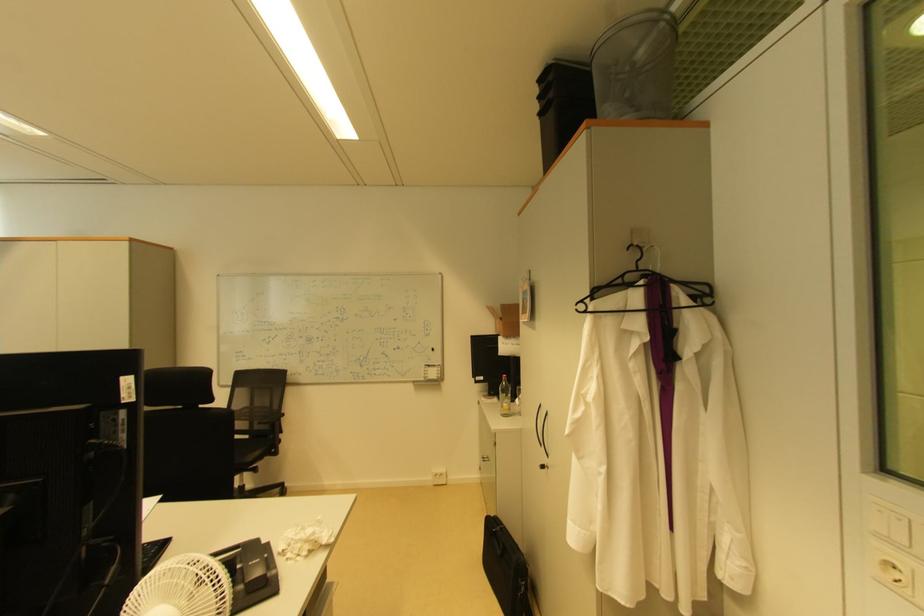
Where is `white desk fan`? white desk fan is located at coordinates (181, 589).